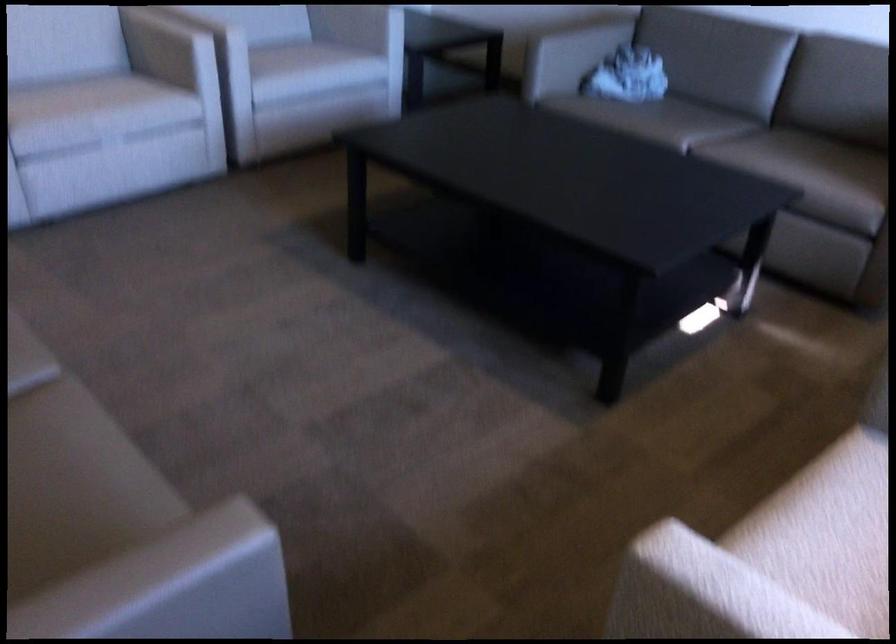
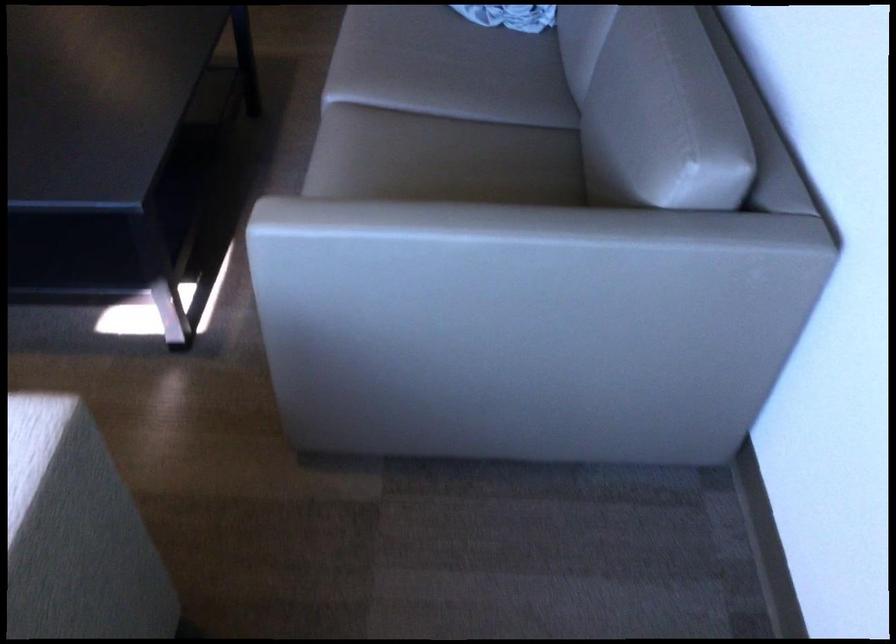
In the second image, find the point that corresponds to the point at 681,116 in the first image.

(463, 73)